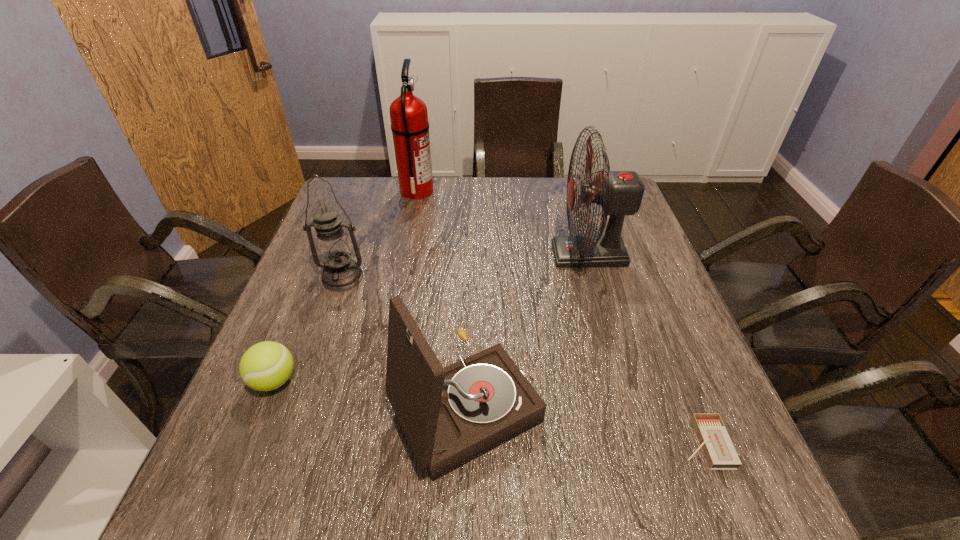
Find the location of a particular element. This screenshot has height=540, width=960. fire extinguisher is located at coordinates (409, 118).

Identify the location of fan. (619, 193).

Identify the location of oil lamp. This screenshot has width=960, height=540. (340, 273).

Find the location of a particular element. Image resolution: width=960 pixels, height=540 pixels. phonograph record is located at coordinates (450, 416).

Where is `the fifth tallest object`? The image size is (960, 540). the fifth tallest object is located at coordinates (265, 366).

This screenshot has width=960, height=540. I want to click on the shortest object, so click(x=718, y=449).

What are the coordinates of `blank area located 0.060m at the nozzle of the fire extinguisher` in the screenshot? It's located at (452, 191).

Identify the location of blank area located 0.340m on the front-facing side of the fan. The height and width of the screenshot is (540, 960). (426, 254).

Image resolution: width=960 pixels, height=540 pixels. What are the coordinates of `free space located on the front-facing side of the fan` in the screenshot? It's located at (438, 254).

The height and width of the screenshot is (540, 960). Find the location of `free space located 0.180m on the front-facing side of the fan`. free space located 0.180m on the front-facing side of the fan is located at coordinates (486, 254).